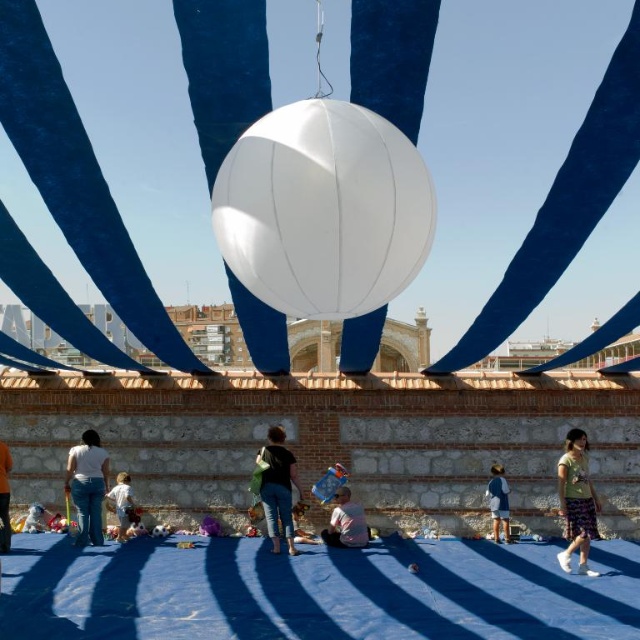
Can you confirm if pink fabric at center is positioned to the right of light brown shorts at lower left?

Correct, you'll find pink fabric at center to the right of light brown shorts at lower left.

Is point (352, 509) farther from viewer compared to point (122, 490)?

No, (352, 509) is closer to viewer.

Does point (330, 541) come in front of point (116, 540)?

Yes.

Locate an element on the screen. The image size is (640, 640). pink fabric at center is located at coordinates (346, 522).

Is white cotton shirt at lower left wider than white plush toy at center?

In fact, white cotton shirt at lower left might be narrower than white plush toy at center.

Is white cotton shirt at lower left to the left of white plush toy at center from the viewer's perspective?

No, white cotton shirt at lower left is not to the left of white plush toy at center.

Which is in front, point (96, 499) or point (29, 525)?

Point (96, 499) is in front.

The image size is (640, 640). I want to click on white cotton shirt at lower left, so click(88, 486).

Can you confirm if white matte balloon at center is positioned to the left of pink fabric at center?

Yes, white matte balloon at center is to the left of pink fabric at center.

Which is in front, point (369, 154) or point (362, 518)?

Point (369, 154) is more forward.

This screenshot has height=640, width=640. Find the location of `white matte balloon at center`. white matte balloon at center is located at coordinates (323, 209).